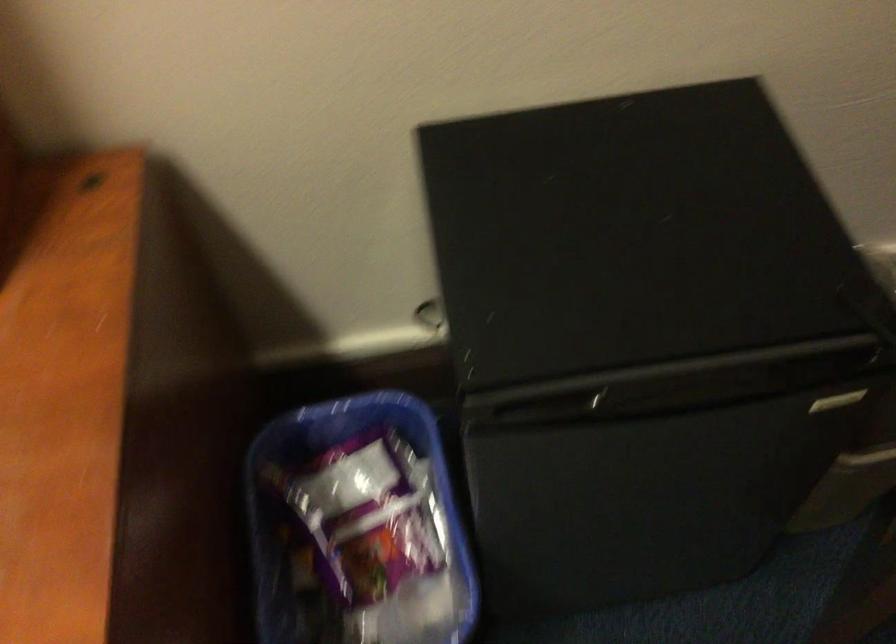
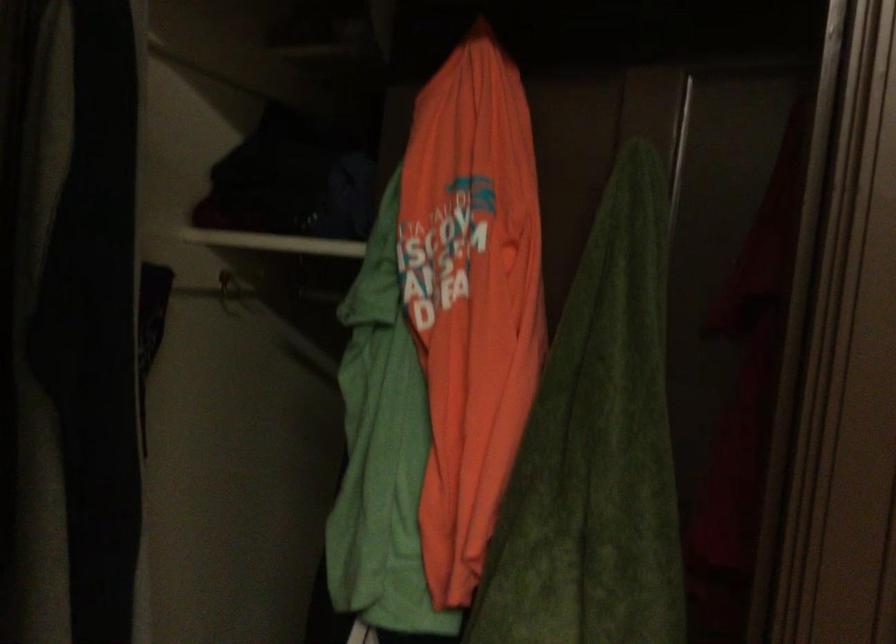
Looking at this image, the first image is from the beginning of the video and the second image is from the end. How did the camera likely rotate when shooting the video?

The rotation direction of the camera is right-up.